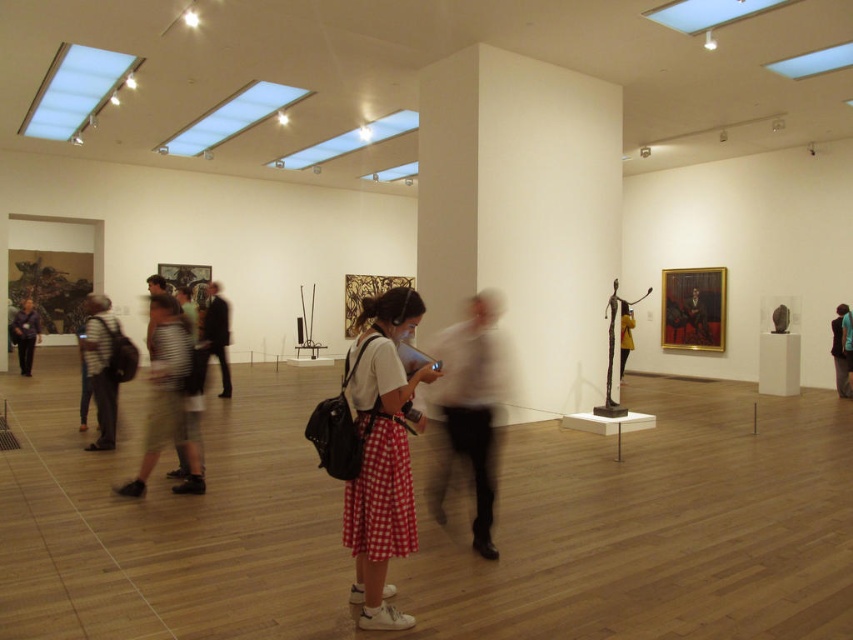
Question: Which of the following is the closest to the observer?

Choices:
 (A) (840, 396)
 (B) (625, 333)

Answer: (A)

Question: Is white matte shirt at center in front of khaki shorts at left?

Choices:
 (A) yes
 (B) no

Answer: (A)

Question: In this image, where is white matte shirt at center located relative to matte black backpack at left?

Choices:
 (A) below
 (B) above

Answer: (A)

Question: Can you confirm if white matte shirt at center is positioned to the right of striped shirt at left?

Choices:
 (A) no
 (B) yes

Answer: (B)

Question: Which object is closer to the camera taking this photo?

Choices:
 (A) matte black backpack at left
 (B) white matte shirt at center

Answer: (B)

Question: Estimate the real-world distances between objects in this image. Which object is farther from the red checkered skirt at center?

Choices:
 (A) blue denim jacket at lower right
 (B) khaki shorts at left
 (C) white matte shirt at center

Answer: (A)